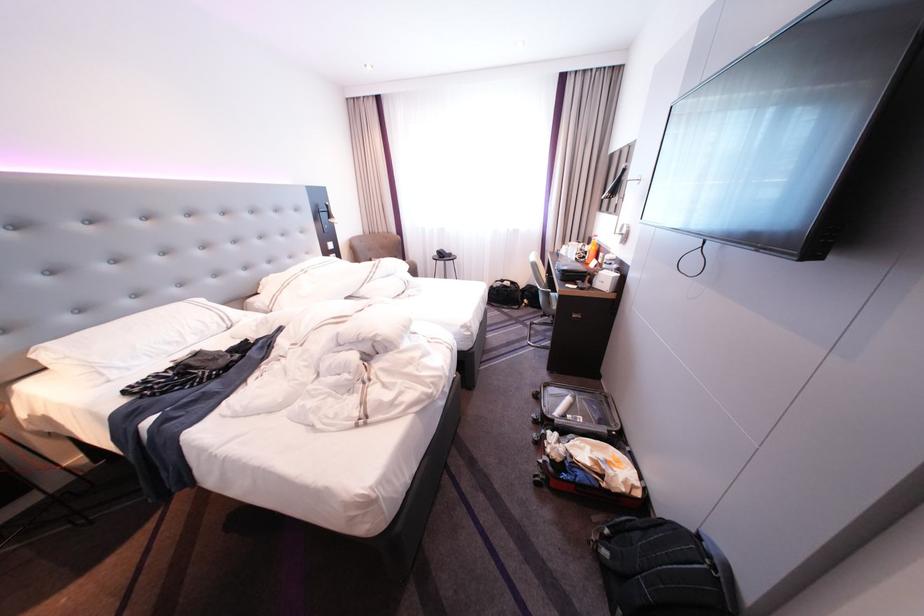
This screenshot has width=924, height=616. In order to click on black travel bag in this screenshot , I will do `click(662, 570)`.